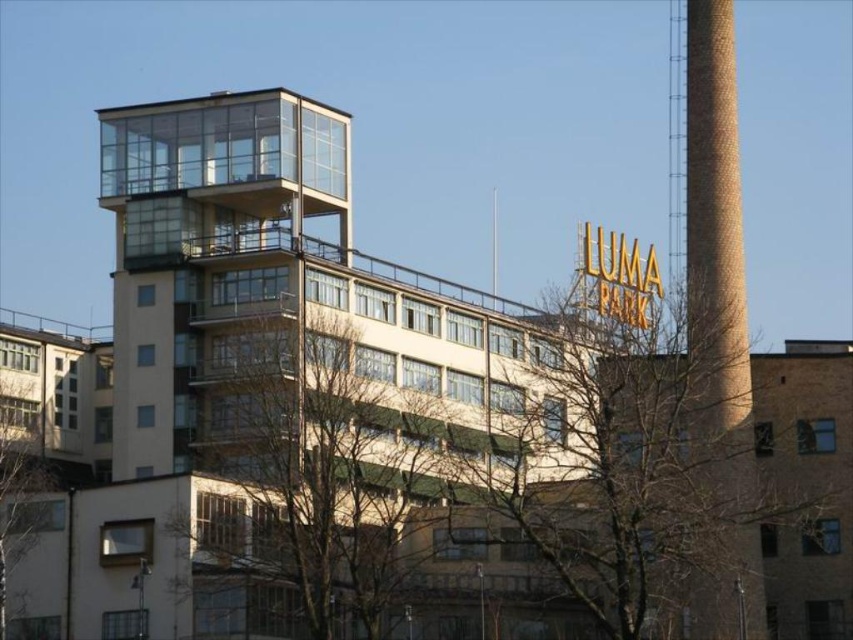
You are standing in front of the building and notice two sets of bare branches. Which set of bare branches at center or bare branches at left is closer to the right side of the building?

The bare branches at center is to the right of bare branches at left, so the bare branches at center is closer to the right side of the building.

You are an urban planner assessing the building for potential green space integration. The bare branches at center and the brown brick chimney at right are key elements in your plan. Which of these two objects has a greater width, and how might this affect your design considerations?

The bare branches at center are wider than the brown brick chimney at right. This suggests that the area around the branches may require more space for potential greenery integration, while the narrower chimney could be a suitable location for smaller installations or signage.

Based on the photo, you are an architect analyzing the building. Which object is wider when comparing the brown brick chimney at right and the bare branches at left?

The brown brick chimney at right is wider than the bare branches at left.